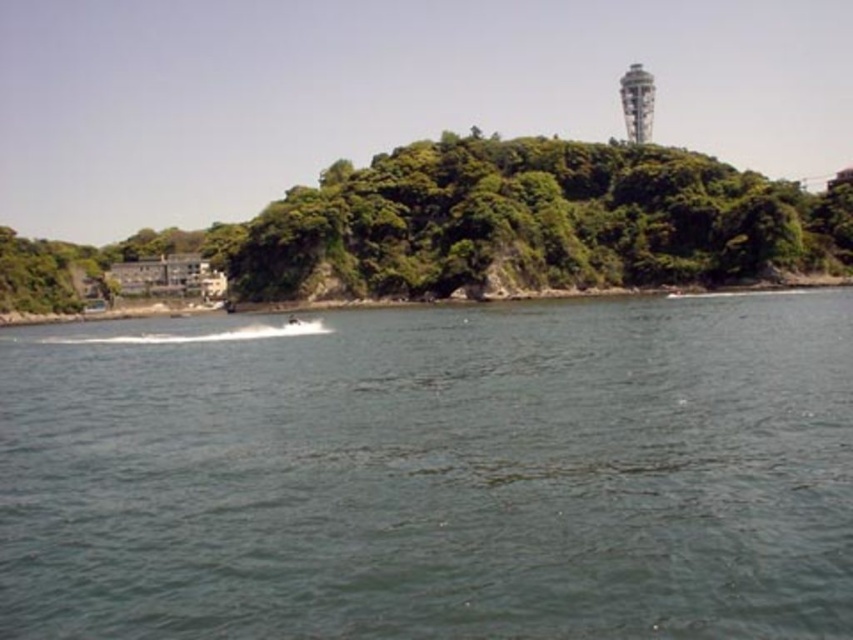
Is dark blue water at center wider than white concrete tower at upper center?

Indeed, dark blue water at center has a greater width compared to white concrete tower at upper center.

Is dark blue water at center shorter than white concrete tower at upper center?

Yes, dark blue water at center is shorter than white concrete tower at upper center.

Which is behind, point (843, 417) or point (641, 125)?

Positioned behind is point (641, 125).

Locate an element on the screen. This screenshot has width=853, height=640. dark blue water at center is located at coordinates (434, 474).

The width and height of the screenshot is (853, 640). What do you see at coordinates (434, 474) in the screenshot? I see `dark blue water at center` at bounding box center [434, 474].

Which of these two, dark blue water at center or green leafy trees at center, stands taller?

Standing taller between the two is green leafy trees at center.

Which is behind, point (305, 621) or point (264, 292)?

Point (264, 292)

Identify the location of dark blue water at center. (434, 474).

Can you confirm if green leafy trees at center is positioned to the right of white concrete tower at upper center?

No, green leafy trees at center is not to the right of white concrete tower at upper center.

Does green leafy trees at center appear on the left side of white concrete tower at upper center?

Yes, green leafy trees at center is to the left of white concrete tower at upper center.

Locate an element on the screen. The image size is (853, 640). green leafy trees at center is located at coordinates (486, 225).